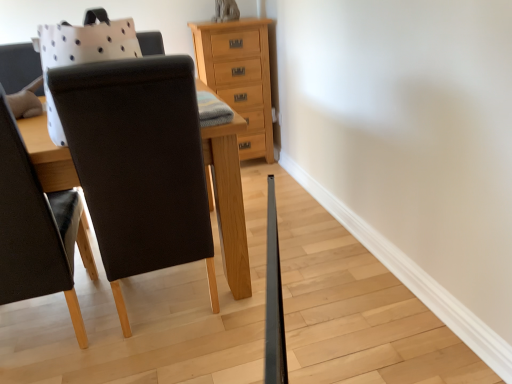
The width and height of the screenshot is (512, 384). Find the location of `vacant region under wooden table at center (from a real-world perspective)`. vacant region under wooden table at center (from a real-world perspective) is located at coordinates (166, 301).